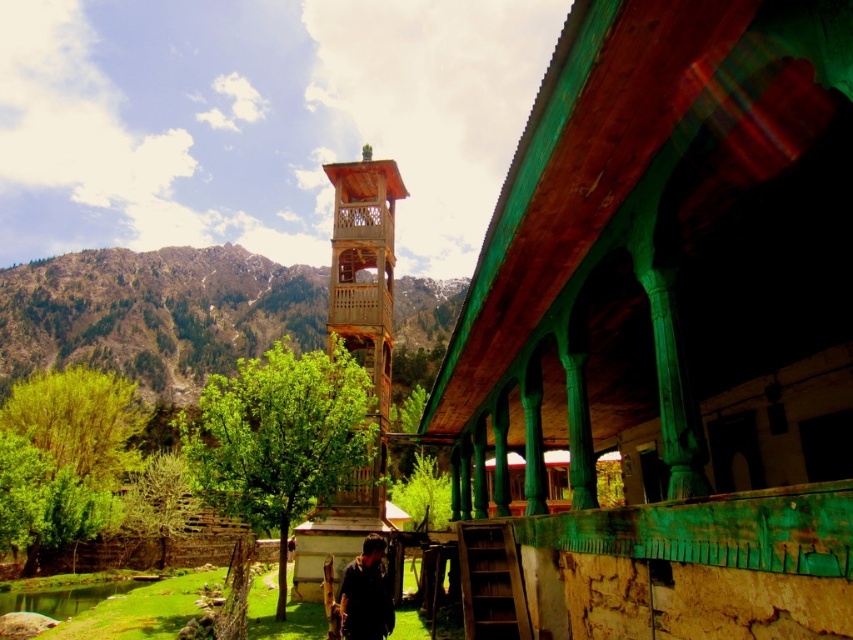
Question: From the image, what is the correct spatial relationship of wooden lattice bell tower at center in relation to dark blue shirt at center?

Choices:
 (A) above
 (B) below

Answer: (A)

Question: Based on their relative distances, which object is farther from the dark blue shirt at center?

Choices:
 (A) wooden lattice bell tower at center
 (B) green painted wood at center

Answer: (A)

Question: Can you confirm if green painted wood at center is positioned below dark blue shirt at center?

Choices:
 (A) no
 (B) yes

Answer: (A)

Question: Based on their relative distances, which object is farther from the green painted wood at center?

Choices:
 (A) dark blue shirt at center
 (B) wooden lattice bell tower at center

Answer: (B)

Question: Is green painted wood at center below wooden lattice bell tower at center?

Choices:
 (A) no
 (B) yes

Answer: (B)

Question: Estimate the real-world distances between objects in this image. Which object is closer to the green painted wood at center?

Choices:
 (A) dark blue shirt at center
 (B) wooden lattice bell tower at center

Answer: (A)